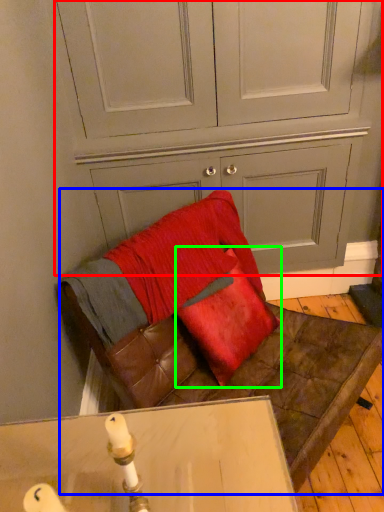
Question: Which object is positioned closest to dresser (highlighted by a red box)? Select from furniture (highlighted by a blue box) and throw pillow (highlighted by a green box).

Choices:
 (A) furniture
 (B) throw pillow

Answer: (B)